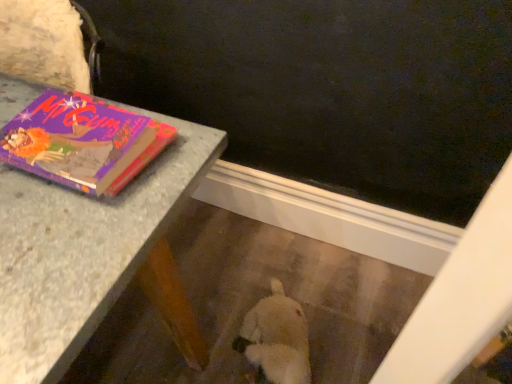
Question: In terms of height, does granite table at upper left look taller or shorter compared to purple matte book at upper left?

Choices:
 (A) short
 (B) tall

Answer: (B)

Question: Based on their sizes in the image, would you say granite table at upper left is bigger or smaller than purple matte book at upper left?

Choices:
 (A) big
 (B) small

Answer: (A)

Question: In the image, is granite table at upper left on the left side or the right side of purple matte book at upper left?

Choices:
 (A) left
 (B) right

Answer: (A)

Question: In the image, is purple matte book at upper left positioned in front of or behind granite table at upper left?

Choices:
 (A) front
 (B) behind

Answer: (A)

Question: From the image's perspective, is purple matte book at upper left above or below granite table at upper left?

Choices:
 (A) below
 (B) above

Answer: (A)

Question: Visually, is purple matte book at upper left positioned to the left or to the right of granite table at upper left?

Choices:
 (A) left
 (B) right

Answer: (B)

Question: Would you say purple matte book at upper left is inside or outside granite table at upper left?

Choices:
 (A) inside
 (B) outside

Answer: (B)